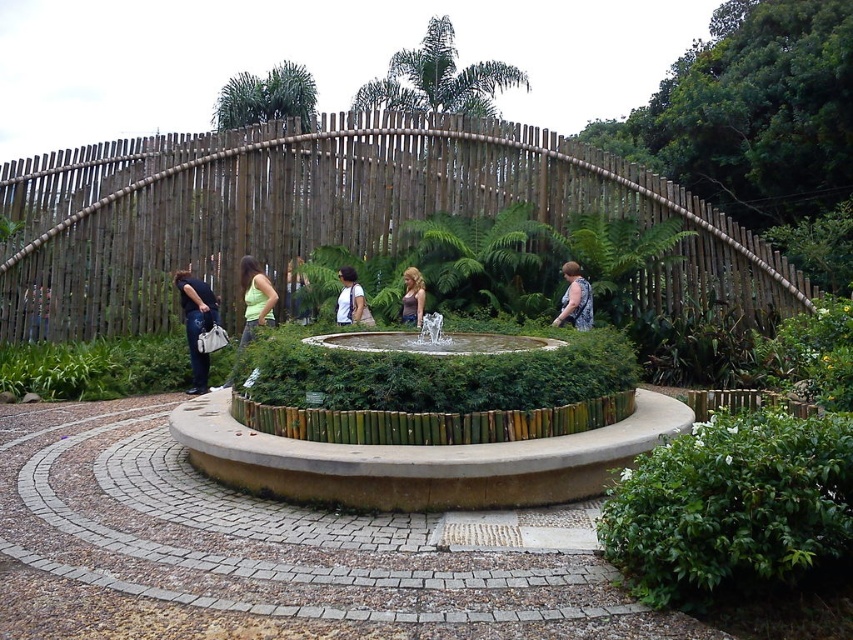
Question: Which object appears closest to the camera in this image?

Choices:
 (A) green matte tank top at center
 (B) matte black shirt at left

Answer: (A)

Question: Can you confirm if green matte tank top at center is positioned to the right of matte purple tank top at center?

Choices:
 (A) no
 (B) yes

Answer: (A)

Question: Can you confirm if brown wooden fence at upper center is positioned below matte black shirt at left?

Choices:
 (A) yes
 (B) no

Answer: (B)

Question: Which point is farther to the camera?

Choices:
 (A) (566, 305)
 (B) (303, 285)

Answer: (B)

Question: Among these objects, which one is farthest from the camera?

Choices:
 (A) matte black dress at center
 (B) brown wooden fence at upper center
 (C) matte purple tank top at center

Answer: (B)

Question: Can you confirm if matte white shirt at center is thinner than green fabric shirt at center?

Choices:
 (A) no
 (B) yes

Answer: (B)